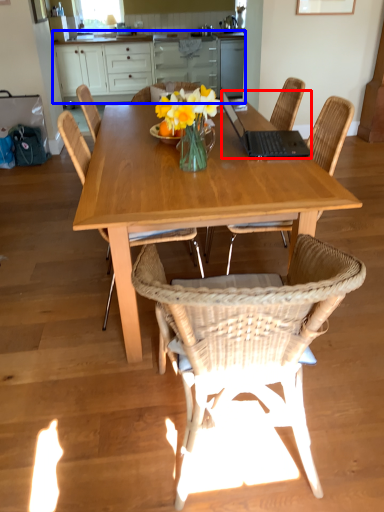
Question: Which of the following is the farthest to the observer, laptop (highlighted by a red box) or cabinetry (highlighted by a blue box)?

Choices:
 (A) laptop
 (B) cabinetry

Answer: (B)